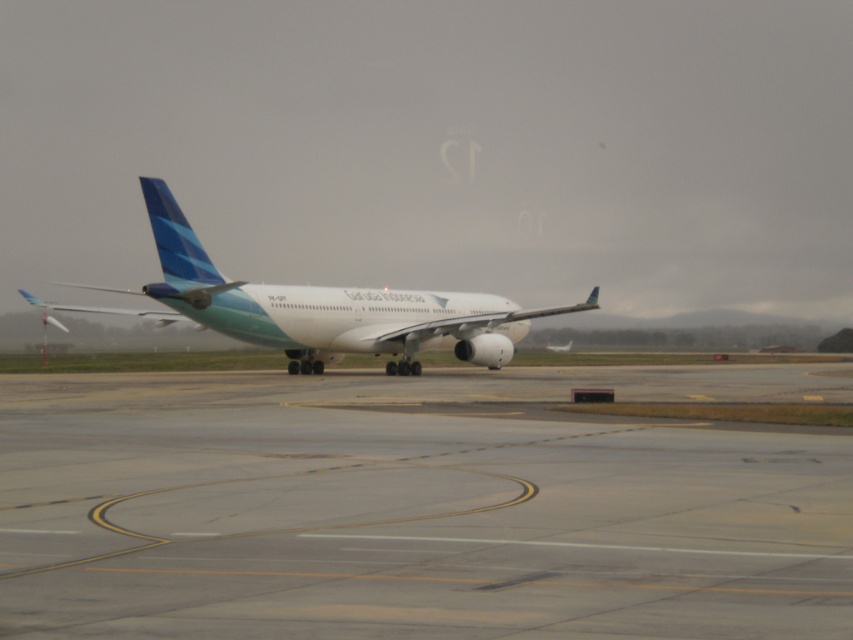
Does gray asphalt runway at center appear under white glossy airplane at center?

Yes, gray asphalt runway at center is below white glossy airplane at center.

Locate an element on the screen. gray asphalt runway at center is located at coordinates (416, 508).